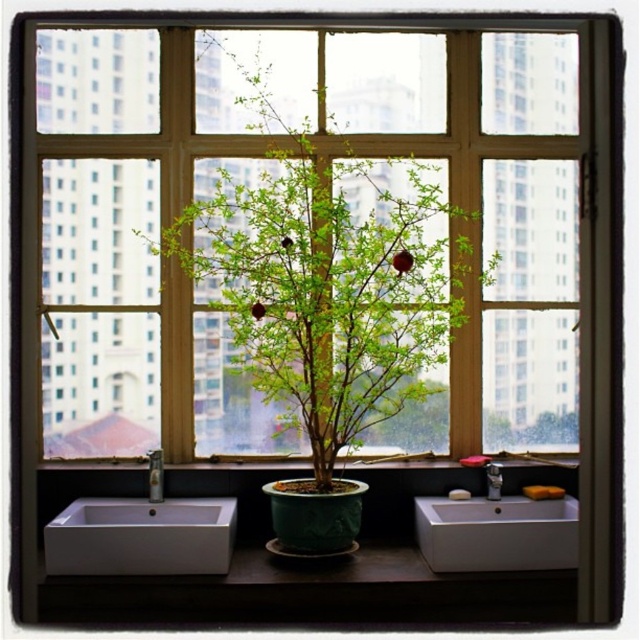
Is white ceramic faucet at center wider than brushed metal faucet at lower center?

Yes, white ceramic faucet at center is wider than brushed metal faucet at lower center.

Does white ceramic faucet at center appear on the right side of brushed metal faucet at lower center?

In fact, white ceramic faucet at center is to the left of brushed metal faucet at lower center.

Does point (157, 465) come behind point (486, 493)?

No, (157, 465) is in front of (486, 493).

The width and height of the screenshot is (640, 640). In order to click on white ceramic faucet at center in this screenshot , I will do `click(156, 476)`.

What do you see at coordinates (467, 460) in the screenshot?
I see `green ceramic pot at center` at bounding box center [467, 460].

Which is more to the left, green ceramic pot at center or white ceramic faucet at center?

white ceramic faucet at center is more to the left.

Identify the location of green ceramic pot at center. The image size is (640, 640). (467, 460).

Where is `green ceramic pot at center`? green ceramic pot at center is located at coordinates (467, 460).

Looking at this image, can you confirm if white glossy sink at left is positioned to the left of white glossy sink at lower center?

Yes, white glossy sink at left is to the left of white glossy sink at lower center.

From the picture: Which is more to the right, white glossy sink at left or white glossy sink at lower center?

From the viewer's perspective, white glossy sink at lower center appears more on the right side.

Locate an element on the screen. white glossy sink at left is located at coordinates (138, 531).